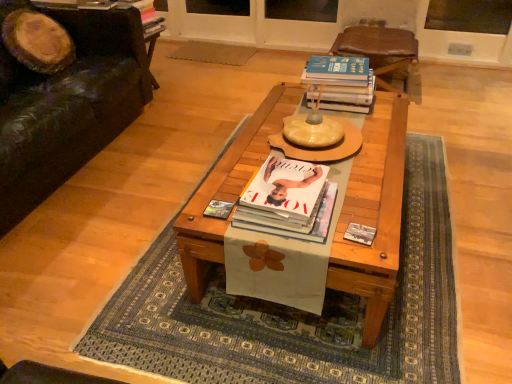
At what (x,y) coordinates should I click in order to perform the action: click on free point above wooden coffee table at center (from a real-world perspective). Please return your answer as a coordinate pair (x, y). The width and height of the screenshot is (512, 384). Looking at the image, I should click on (320, 155).